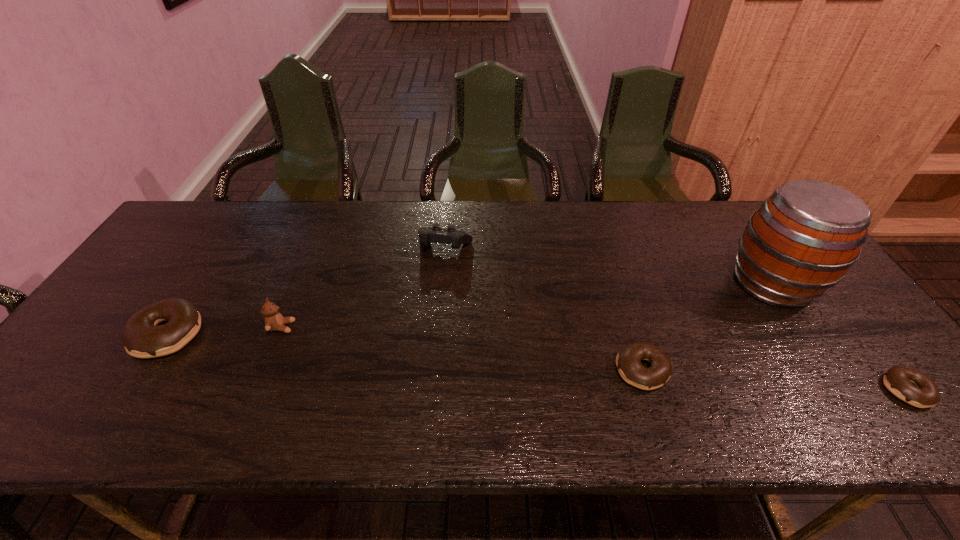
Where is `the leftmost object`? The height and width of the screenshot is (540, 960). the leftmost object is located at coordinates coord(142,338).

Identify the location of the tallest doughnut. coord(142,338).

Identify the location of the second shortest object. Image resolution: width=960 pixels, height=540 pixels. (628, 361).

Where is `the fourth object from left to right`? This screenshot has height=540, width=960. the fourth object from left to right is located at coordinates (628, 361).

Identify the location of the shortest object. (909, 385).

At what (x,y) coordinates should I click in order to perform the action: click on the rightmost doughnut. Please return your answer as a coordinate pair (x, y). The height and width of the screenshot is (540, 960). Looking at the image, I should click on (909, 385).

Where is `the third tallest object`? the third tallest object is located at coordinates coord(436,234).

You are a GUI agent. You are given a task and a screenshot of the screen. Output one action in this format:
    pyautogui.click(x=<x>, y=<y>)
    Task: Click on the control
    
    Given the screenshot: What is the action you would take?
    pyautogui.click(x=436, y=234)

The height and width of the screenshot is (540, 960). What are the coordinates of `the tallest object` in the screenshot? It's located at (803, 239).

Find the location of `the second object from left to right`. the second object from left to right is located at coordinates (274, 321).